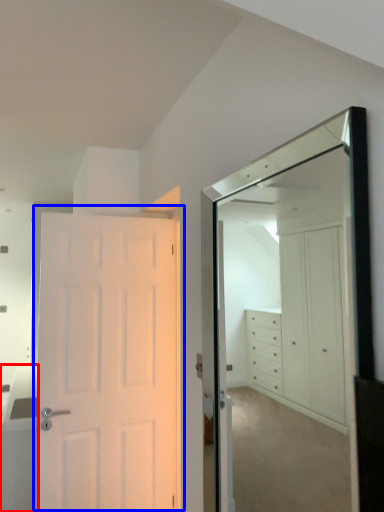
Question: Which of the following is the closest to the observer, cabinetry (highlighted by a red box) or door (highlighted by a blue box)?

Choices:
 (A) cabinetry
 (B) door

Answer: (B)